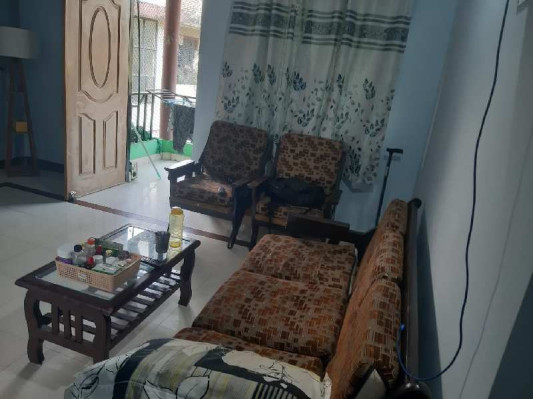
Identify the location of chair. (212, 176), (316, 173).